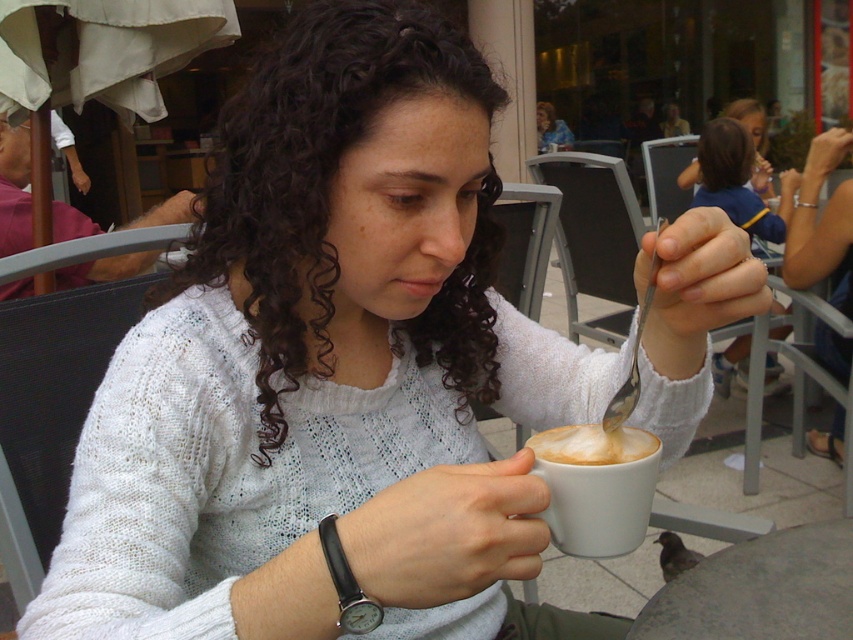
Question: Is white matte cup at center to the right of matte white sweater at center from the viewer's perspective?

Choices:
 (A) no
 (B) yes

Answer: (A)

Question: Which point appears farthest from the camera in this image?

Choices:
 (A) (633, 433)
 (B) (750, 241)
 (C) (648, 474)

Answer: (B)

Question: Considering the relative positions of smooth stone table at lower right and white matte cup at center in the image provided, where is smooth stone table at lower right located with respect to white matte cup at center?

Choices:
 (A) above
 (B) below

Answer: (B)

Question: Estimate the real-world distances between objects in this image. Which object is farther from the foamy white coffee at cup center?

Choices:
 (A) matte white sweater at center
 (B) smooth stone table at lower right

Answer: (A)

Question: Is white knitted sweater at upper center below matte white sweater at center?

Choices:
 (A) yes
 (B) no

Answer: (A)

Question: Which of the following is the farthest from the observer?

Choices:
 (A) (735, 340)
 (B) (552, 468)
 (C) (543, 449)

Answer: (A)